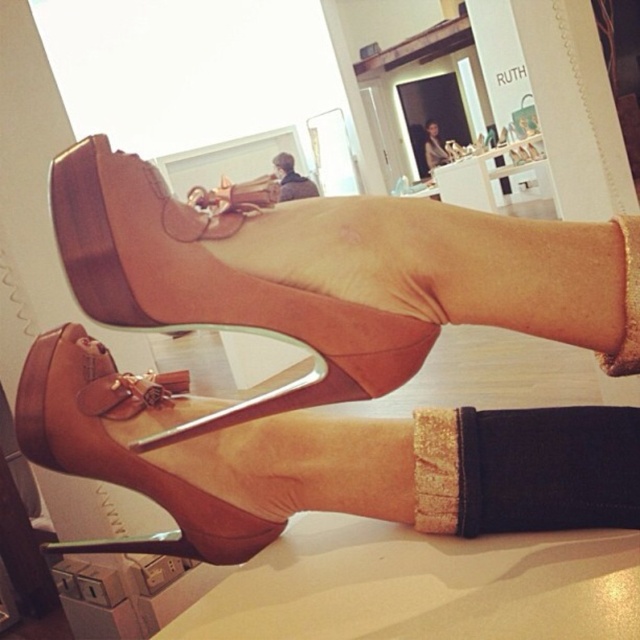
Consider the image. You are a customer in a shoe store trying to decide between the suede brown sandal at center and the matte brown shoe at upper center. Which one has a lower height?

The suede brown sandal at center is shorter than the matte brown shoe at upper center, so the suede brown sandal at center has a lower height.